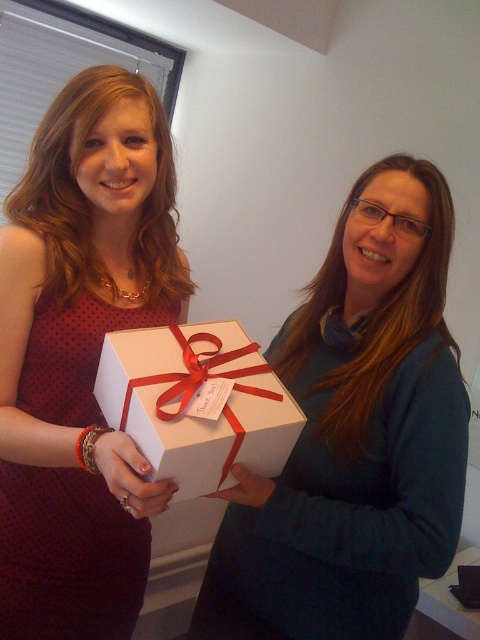
Question: Which object is closer to the camera taking this photo?

Choices:
 (A) matte white sweater at center
 (B) matte black dress at center

Answer: (B)

Question: Among these objects, which one is nearest to the camera?

Choices:
 (A) white matte gift box at center
 (B) matte white sweater at center

Answer: (A)

Question: Does matte white sweater at center have a smaller size compared to white matte gift box at center?

Choices:
 (A) yes
 (B) no

Answer: (B)

Question: Can you confirm if matte white sweater at center is wider than matte black dress at center?

Choices:
 (A) yes
 (B) no

Answer: (A)

Question: Which of the following is the farthest from the observer?

Choices:
 (A) matte white sweater at center
 (B) white matte gift box at center

Answer: (A)

Question: Can you confirm if matte white sweater at center is positioned above matte black dress at center?

Choices:
 (A) yes
 (B) no

Answer: (B)